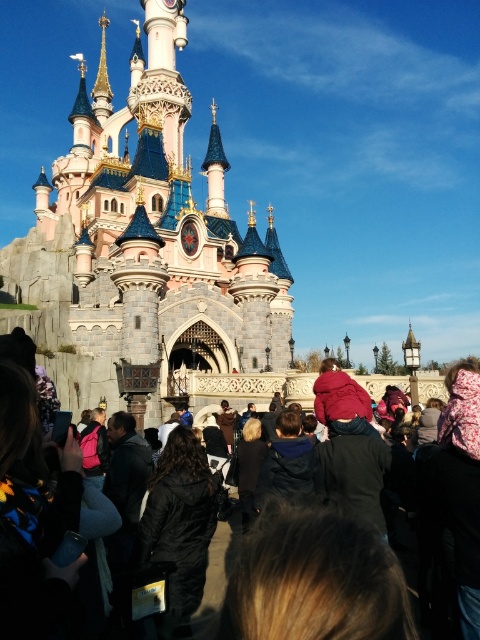
You are standing at the point marked as point (149, 246) in the image. What iconic structure are you facing? Please provide the exact name from the image description.

The point (149, 246) corresponds to the pink stone castle at center, which is the iconic Sleeping Beauty Castle at Disneyland Paris.

You are standing in front of the Sleeping Beauty Castle at Disneyland Paris and see the black fabric crowd at center and the black matte coat at center. Which object is nearer to you?

The black fabric crowd at center is closer to the viewer than the black matte coat at center.

You are standing in front of the Sleeping Beauty Castle at Disneyland Paris. You want to take a photo of the castle without any people blocking the view. The black fabric crowd at center is between you and the castle. Is the crowd close enough to step around easily?

The black fabric crowd at center is 120.15 feet away from the viewer. Since the crowd is quite far away, you can easily step around them to take an unobstructed photo of the castle.